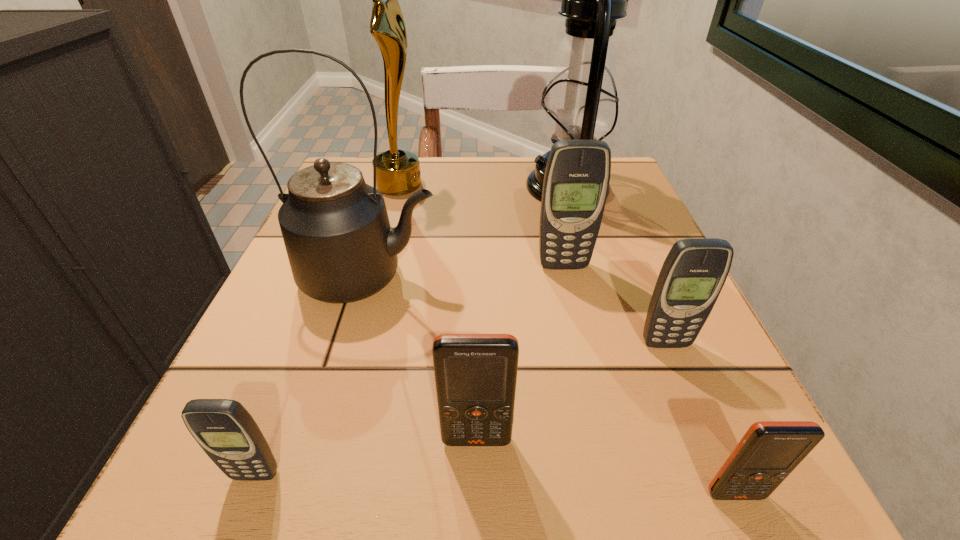
Where is `object that is the closest to the award`? object that is the closest to the award is located at coordinates click(x=341, y=248).

Find the location of a particular element. the second closest object to the third tallest object is located at coordinates (576, 181).

Identify which cellular telephone is located as the third nearest to the nearest object. Please provide its 2D coordinates. Your answer should be formatted as a tuple, i.e. [(x, y)], where the tuple contains the x and y coordinates of a point satisfying the conditions above.

[(576, 181)]

Find the location of a particular element. The width and height of the screenshot is (960, 540). cellular telephone that is the fourth closest to the second smallest gray cellular telephone is located at coordinates (224, 429).

Locate an element on the screen. gray cellular telephone that stands as the third closest to the bigger orange cellular telephone is located at coordinates (576, 181).

Select which gray cellular telephone is the third closest to the smaller orange cellular telephone. Please provide its 2D coordinates. Your answer should be formatted as a tuple, i.e. [(x, y)], where the tuple contains the x and y coordinates of a point satisfying the conditions above.

[(224, 429)]

Where is `vacant region that satisfies the following two spatial constraints: 1. spout on the kettle; 2. on the screen of the smallest gray cellular telephone`? This screenshot has width=960, height=540. vacant region that satisfies the following two spatial constraints: 1. spout on the kettle; 2. on the screen of the smallest gray cellular telephone is located at coordinates (312, 475).

Locate an element on the screen. The width and height of the screenshot is (960, 540). free space that satisfies the following two spatial constraints: 1. on the front-facing side of the award; 2. on the screen of the leftmost gray cellular telephone is located at coordinates (319, 475).